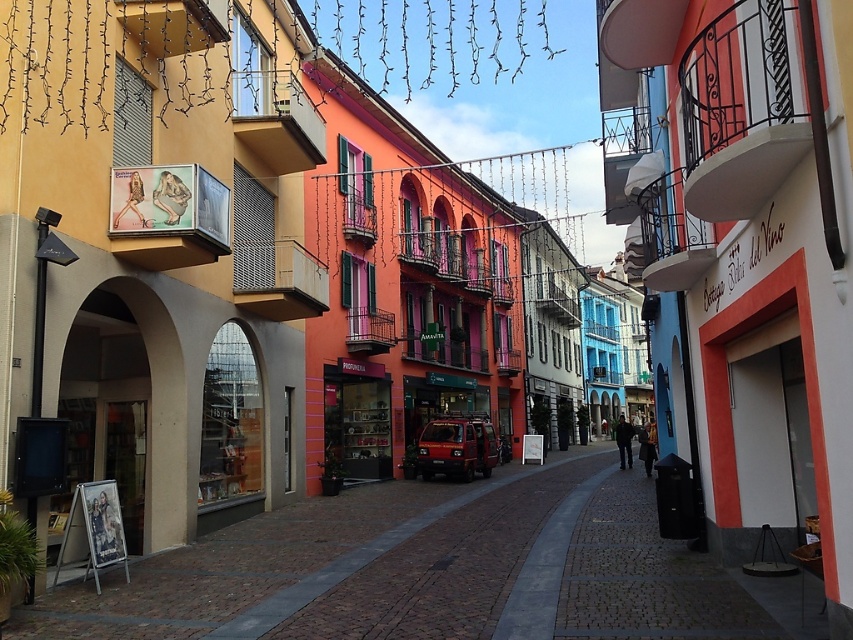
You are a tourist standing at the entrance of the street and want to walk through the brick paved alley at center to reach the other side. However, there is a matte red van at center blocking the path. Based on the scene description, can you determine if the alley is accessible for walking around the van?

The brick paved alley at center is in front of the matte red van at center, meaning the alley is positioned ahead of the van. This suggests the van is parked behind the alley, so the alley itself remains accessible for walking around the van.

Consider the image. You are a delivery person driving a matte red van at center through a narrow brick paved alley at center in a European town. Can you safely navigate your van through the alley without any part of it getting stuck?

The brick paved alley at center is larger in size than matte red van at center, so yes, the matte red van at center can safely navigate through the alley without getting stuck.